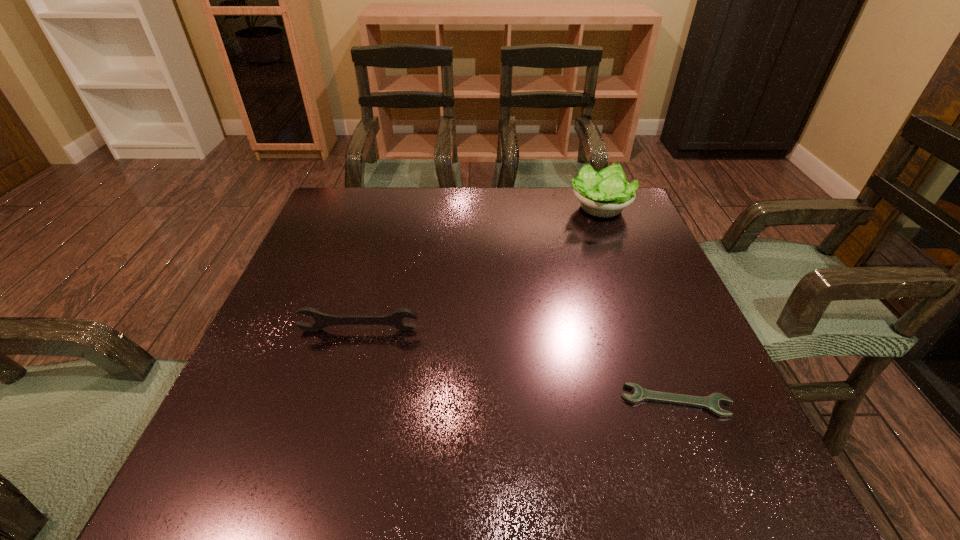
The height and width of the screenshot is (540, 960). In order to click on free location that satisfies the following two spatial constraints: 1. on the open ends of the right wrench; 2. on the left side of the taller wrench in this screenshot , I will do `click(340, 401)`.

At what (x,y) coordinates should I click in order to perform the action: click on vacant region that satisfies the following two spatial constraints: 1. on the open ends of the second farthest object; 2. on the left side of the shorter wrench. Please return your answer as a coordinate pair (x, y). The image size is (960, 540). Looking at the image, I should click on (340, 401).

Locate an element on the screen. The width and height of the screenshot is (960, 540). vacant space that satisfies the following two spatial constraints: 1. on the open ends of the nearest object; 2. on the left side of the taller wrench is located at coordinates coord(340,401).